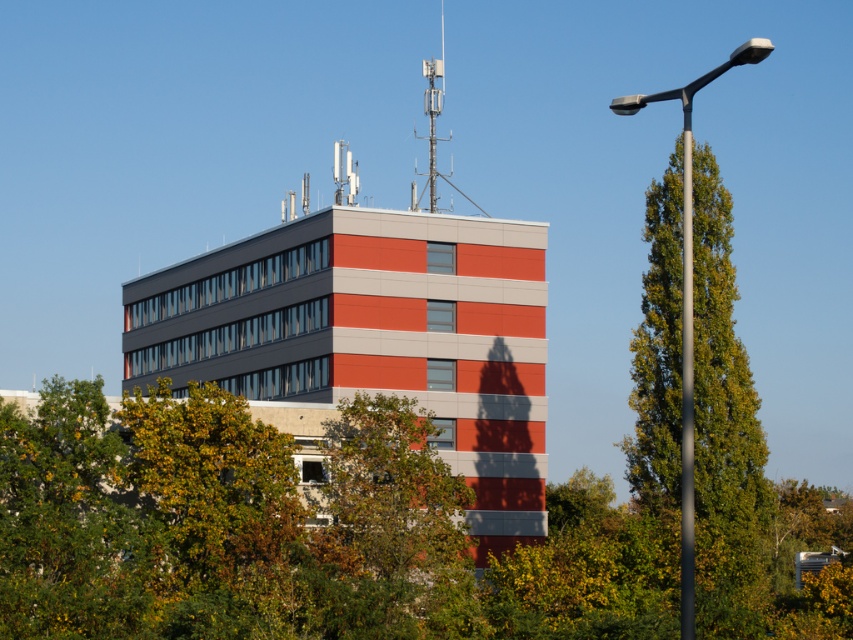
You are standing in front of the red brick building at center and want to take a photo of it. There is a sleek metallic pole at right nearby. Based on their positions, will the pole appear to the left or right side of the building in the photo?

The red brick building at center is positioned under the sleek metallic pole at right, so in the photo, the pole will appear to the right side of the building.

You are standing in front of the building and see two points marked on its facade. The first point is at coordinate point (250, 497) and the second is at point (228, 248). Which point appears closer to you?

Point (250, 497) is in front of point (228, 248), so it appears closer to you.

You are standing at the base of the red brick building at center. You want to walk to the communication tower on the roof. How far will you have to climb vertically?

The communication tower on the roof is part of the red brick building at center, so you don wait to climb vertically to reach it since it is already on top of the building.